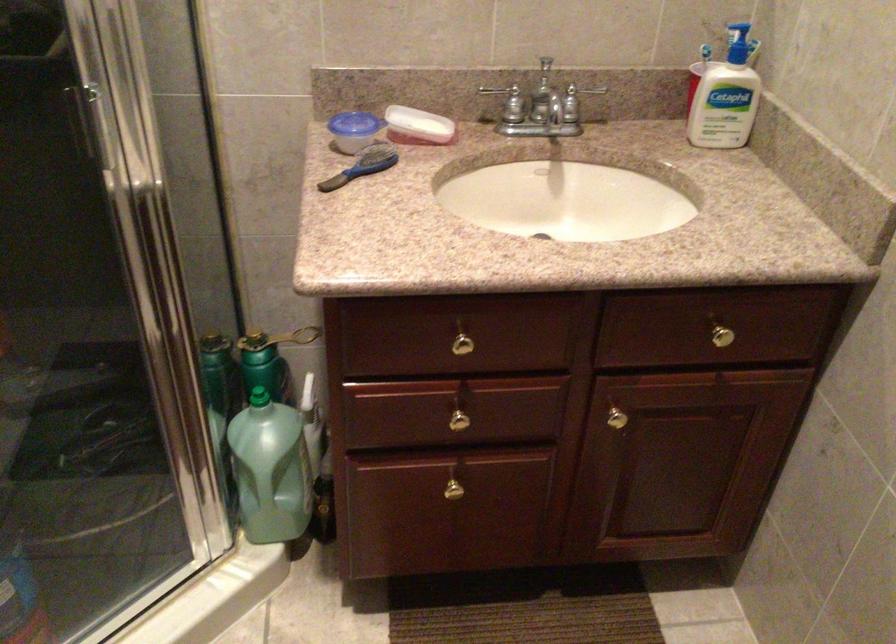
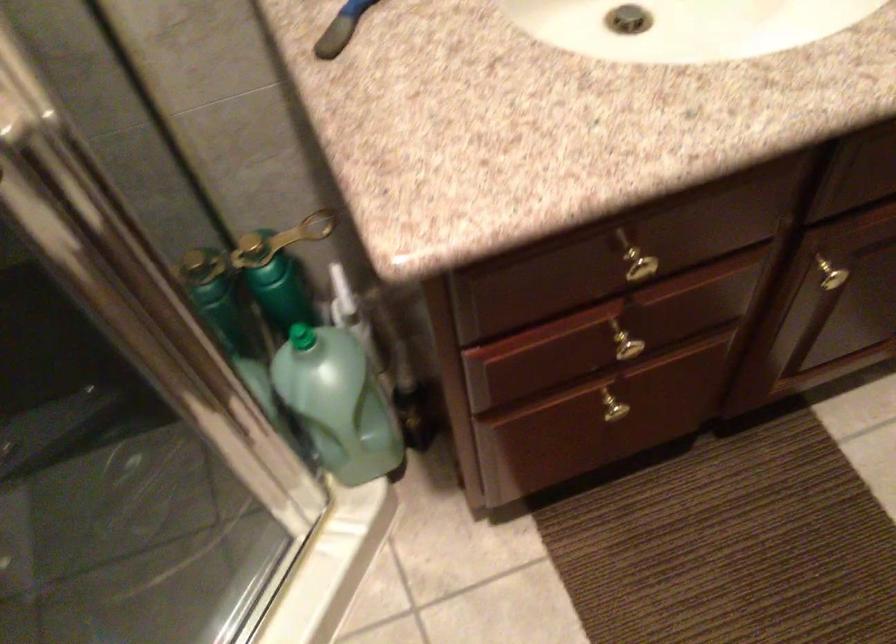
In the second image, find the point that corresponds to (264,453) in the first image.

(338, 402)